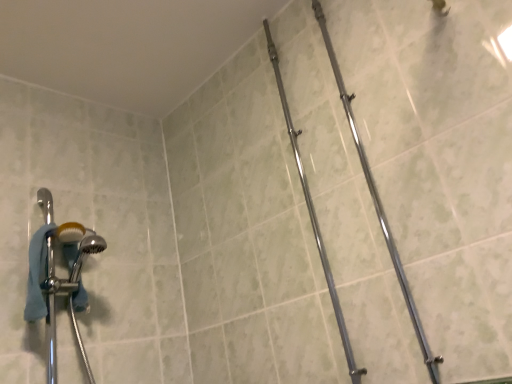
Question: Should I look upward or downward to see polished chrome pipe at center, the 1th pipe in the left-to-right sequence?

Choices:
 (A) up
 (B) down

Answer: (A)

Question: Can you confirm if chrome/metallic pipe at center-right, which ranks as the 2th pipe in left-to-right order, is positioned to the left of polished chrome pipe at center, positioned as the second pipe in right-to-left order?

Choices:
 (A) no
 (B) yes

Answer: (A)

Question: Considering the relative sizes of chrome/metallic pipe at center-right, which ranks as the 2th pipe in left-to-right order, and polished chrome pipe at center, the 1th pipe in the left-to-right sequence, in the image provided, is chrome/metallic pipe at center-right, which ranks as the 2th pipe in left-to-right order, bigger than polished chrome pipe at center, the 1th pipe in the left-to-right sequence,?

Choices:
 (A) no
 (B) yes

Answer: (A)

Question: Considering the relative sizes of chrome/metallic pipe at center-right, placed as the first pipe when sorted from right to left, and polished chrome pipe at center, positioned as the second pipe in right-to-left order, in the image provided, is chrome/metallic pipe at center-right, placed as the first pipe when sorted from right to left, thinner than polished chrome pipe at center, positioned as the second pipe in right-to-left order,?

Choices:
 (A) yes
 (B) no

Answer: (B)

Question: Is chrome/metallic pipe at center-right, placed as the first pipe when sorted from right to left, at the right side of polished chrome pipe at center, positioned as the second pipe in right-to-left order?

Choices:
 (A) no
 (B) yes

Answer: (B)

Question: Considering the relative sizes of chrome/metallic pipe at center-right, which ranks as the 2th pipe in left-to-right order, and polished chrome pipe at center, the 1th pipe in the left-to-right sequence, in the image provided, is chrome/metallic pipe at center-right, which ranks as the 2th pipe in left-to-right order, taller than polished chrome pipe at center, the 1th pipe in the left-to-right sequence,?

Choices:
 (A) no
 (B) yes

Answer: (A)

Question: Is chrome/metallic pipe at center-right, placed as the first pipe when sorted from right to left, facing away from polished chrome pipe at center, the 1th pipe in the left-to-right sequence?

Choices:
 (A) yes
 (B) no

Answer: (B)

Question: From the image's perspective, is polished chrome pipe at center, positioned as the second pipe in right-to-left order, below chrome/metallic pipe at center-right, placed as the first pipe when sorted from right to left?

Choices:
 (A) yes
 (B) no

Answer: (A)

Question: From the image's perspective, would you say polished chrome pipe at center, the 1th pipe in the left-to-right sequence, is positioned over chrome/metallic pipe at center-right, placed as the first pipe when sorted from right to left?

Choices:
 (A) yes
 (B) no

Answer: (B)

Question: Would you say polished chrome pipe at center, the 1th pipe in the left-to-right sequence, is a long distance from chrome/metallic pipe at center-right, which ranks as the 2th pipe in left-to-right order?

Choices:
 (A) no
 (B) yes

Answer: (A)

Question: Considering the relative sizes of polished chrome pipe at center, positioned as the second pipe in right-to-left order, and chrome/metallic pipe at center-right, which ranks as the 2th pipe in left-to-right order, in the image provided, is polished chrome pipe at center, positioned as the second pipe in right-to-left order, shorter than chrome/metallic pipe at center-right, which ranks as the 2th pipe in left-to-right order,?

Choices:
 (A) no
 (B) yes

Answer: (A)

Question: Is the depth of polished chrome pipe at center, the 1th pipe in the left-to-right sequence, less than that of chrome/metallic pipe at center-right, placed as the first pipe when sorted from right to left?

Choices:
 (A) yes
 (B) no

Answer: (B)

Question: Does polished chrome pipe at center, the 1th pipe in the left-to-right sequence, have a greater height compared to chrome/metallic pipe at center-right, which ranks as the 2th pipe in left-to-right order?

Choices:
 (A) no
 (B) yes

Answer: (B)

Question: From the image's perspective, is chrome/metallic pipe at center-right, placed as the first pipe when sorted from right to left, above or below polished chrome pipe at center, positioned as the second pipe in right-to-left order?

Choices:
 (A) below
 (B) above

Answer: (B)